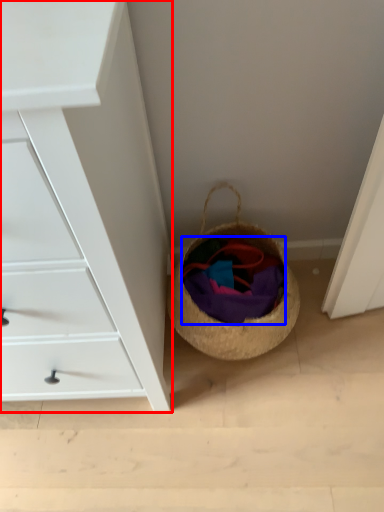
Question: Which of the following is the closest to the observer, chest of drawers (highlighted by a red box) or clothing (highlighted by a blue box)?

Choices:
 (A) chest of drawers
 (B) clothing

Answer: (A)